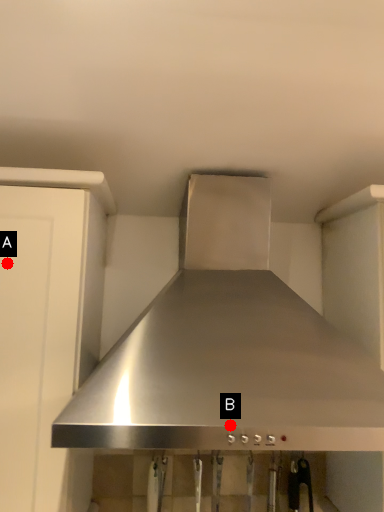
Question: Two points are circled on the image, labeled by A and B beside each circle. Which point is closer to the camera?

Choices:
 (A) A is closer
 (B) B is closer

Answer: (B)